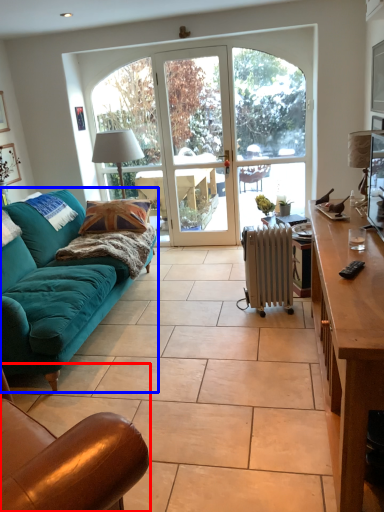
Question: Which of the following is the farthest to the observer, chair (highlighted by a red box) or studio couch (highlighted by a blue box)?

Choices:
 (A) chair
 (B) studio couch

Answer: (B)